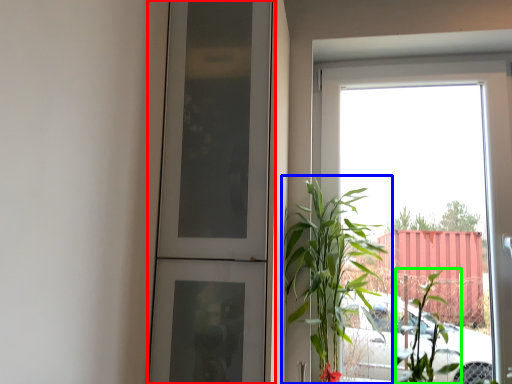
Question: Estimate the real-world distances between objects in this image. Which object is farther from door (highlighted by a red box), houseplant (highlighted by a blue box) or plant (highlighted by a green box)?

Choices:
 (A) houseplant
 (B) plant

Answer: (B)